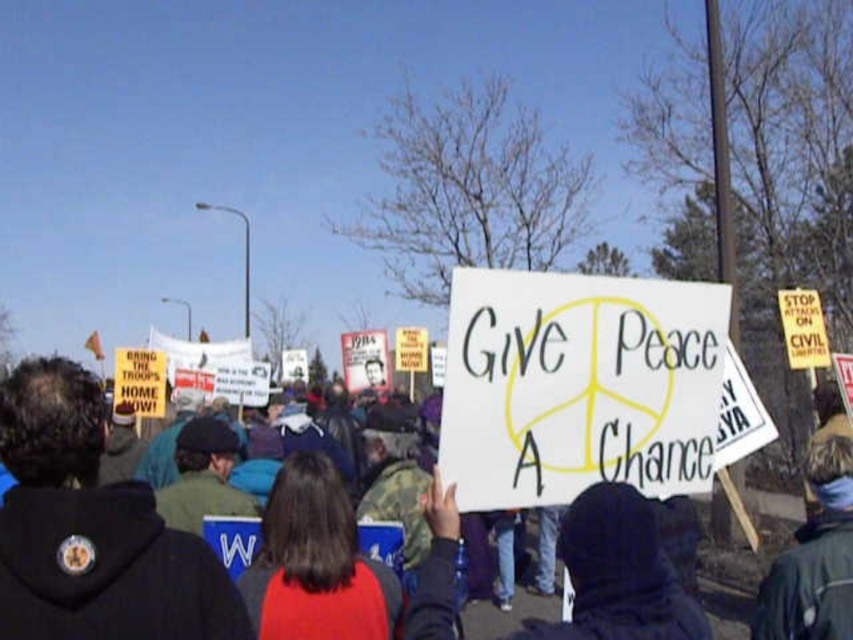
You are a photographer trying to capture the protest scene. You notice the white paper sign at center and the dark blue hoodie at center. Which object would appear bigger in your photo?

The white paper sign at center appears bigger in the photo because it has a larger size compared to the dark blue hoodie at center.

You are a photographer standing at the edge of the protest. You want to take a photo of the white paper sign at center and the dark blue hoodie at center. The camera you have can only focus on objects within 1.5 meters of each other. Can you capture both in a single focused shot?

The distance between the white paper sign at center and dark blue hoodie at center is 1.38 meters, which is within the camera focus range of 1.5 meters. Therefore, you can capture both in a single focused shot.

You are a photographer at the protest scene. You want to capture a photo where both the white paper sign at center and the dark blue hoodie at center are clearly visible. Based on their positions, is the sign above or below the hoodie?

The white paper sign at center is located above the dark blue hoodie at center, so the sign is above the hoodie in the photo.